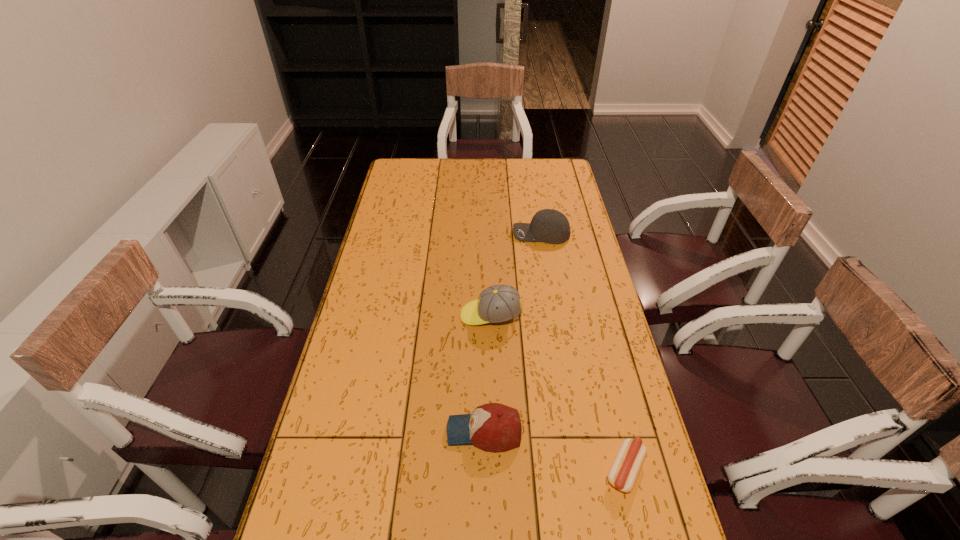
Locate an element on the screen. The image size is (960, 540). free space between the farthest baseball cap and the second shortest object is located at coordinates (513, 333).

Locate an element on the screen. The width and height of the screenshot is (960, 540). object that is the closest to the farthest object is located at coordinates (498, 303).

Identify which object is the second nearest to the shortest baseball cap. Please provide its 2D coordinates. Your answer should be formatted as a tuple, i.e. [(x, y)], where the tuple contains the x and y coordinates of a point satisfying the conditions above.

[(498, 303)]

Identify which baseball cap is the second nearest to the shortest object. Please provide its 2D coordinates. Your answer should be formatted as a tuple, i.e. [(x, y)], where the tuple contains the x and y coordinates of a point satisfying the conditions above.

[(498, 303)]

Identify which baseball cap is the second nearest to the farthest object. Please provide its 2D coordinates. Your answer should be formatted as a tuple, i.e. [(x, y)], where the tuple contains the x and y coordinates of a point satisfying the conditions above.

[(493, 427)]

Where is `vacant region that satisfies the following two spatial constraints: 1. on the back side of the sausage; 2. on the front-facing side of the third nearest object`? vacant region that satisfies the following two spatial constraints: 1. on the back side of the sausage; 2. on the front-facing side of the third nearest object is located at coordinates (588, 315).

The width and height of the screenshot is (960, 540). Find the location of `vacant space that satisfies the following two spatial constraints: 1. on the front-facing side of the shortest baseball cap; 2. on the left side of the sausage`. vacant space that satisfies the following two spatial constraints: 1. on the front-facing side of the shortest baseball cap; 2. on the left side of the sausage is located at coordinates (485, 470).

Image resolution: width=960 pixels, height=540 pixels. Identify the location of free space that satisfies the following two spatial constraints: 1. on the front-facing side of the sausage; 2. on the right side of the third tallest object. (485, 470).

In order to click on free location that satisfies the following two spatial constraints: 1. on the front-facing side of the shortest object; 2. on the left side of the second farthest object in this screenshot , I will do 494,470.

Where is `vacant area that satisfies the following two spatial constraints: 1. on the front-facing side of the nearest baseball cap; 2. on the right side of the shortest object`? Image resolution: width=960 pixels, height=540 pixels. vacant area that satisfies the following two spatial constraints: 1. on the front-facing side of the nearest baseball cap; 2. on the right side of the shortest object is located at coordinates (485, 470).